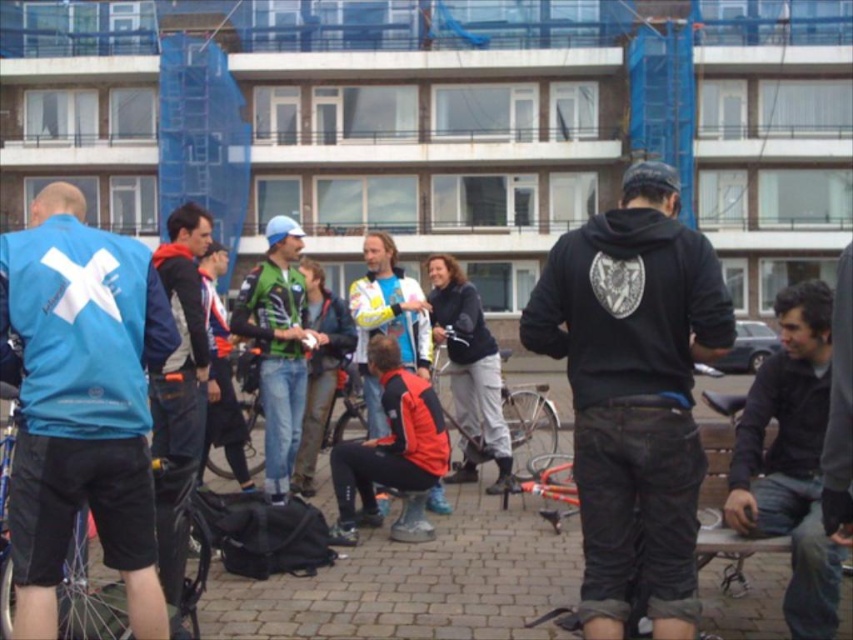
Question: Which point is closer to the camera?

Choices:
 (A) (367, 387)
 (B) (560, 346)
 (C) (537, 445)

Answer: (B)

Question: Among these points, which one is nearest to the camera?

Choices:
 (A) (155, 417)
 (B) (819, 448)
 (C) (297, 394)
 (D) (149, 326)

Answer: (D)

Question: Among these objects, which one is farthest from the camera?

Choices:
 (A) black matte hoodie at center
 (B) green fabric jacket at center
 (C) matte yellow helmet at center
 (D) dark gray cotton jacket at lower right

Answer: (B)

Question: Does black matte hoodie at center appear over dark blue jacket at center?

Choices:
 (A) no
 (B) yes

Answer: (B)

Question: Is black matte hoodie at center below matte blue jacket at left?

Choices:
 (A) yes
 (B) no

Answer: (A)

Question: Can you confirm if dark gray cotton jacket at lower right is positioned below green fabric jacket at center?

Choices:
 (A) yes
 (B) no

Answer: (A)